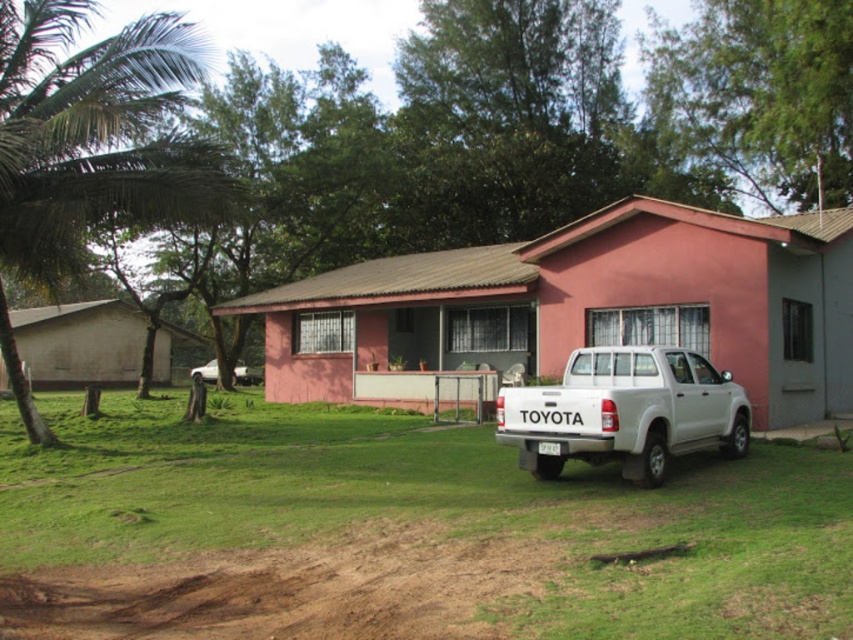
Does brown sandy dirt track at lower center appear on the left side of white matte pickup truck at lower right?

Correct, you'll find brown sandy dirt track at lower center to the left of white matte pickup truck at lower right.

Does brown sandy dirt track at lower center have a greater height compared to white matte pickup truck at lower right?

No.

What do you see at coordinates (292, 589) in the screenshot?
I see `brown sandy dirt track at lower center` at bounding box center [292, 589].

The height and width of the screenshot is (640, 853). Find the location of `brown sandy dirt track at lower center`. brown sandy dirt track at lower center is located at coordinates (292, 589).

Who is higher up, green grass at lower center or white matte truck at lower left?

white matte truck at lower left is higher up.

Does green grass at lower center appear under white matte truck at lower left?

Correct, green grass at lower center is located below white matte truck at lower left.

The width and height of the screenshot is (853, 640). Identify the location of green grass at lower center. (407, 531).

Can you confirm if brown sandy dirt track at lower center is taller than green leafy palm tree at left?

Incorrect, brown sandy dirt track at lower center's height is not larger of green leafy palm tree at left's.

Is brown sandy dirt track at lower center shorter than green leafy palm tree at left?

Yes.

Is point (498, 570) behind point (148, 22)?

That is False.

Where is `brown sandy dirt track at lower center`? The width and height of the screenshot is (853, 640). brown sandy dirt track at lower center is located at coordinates (292, 589).